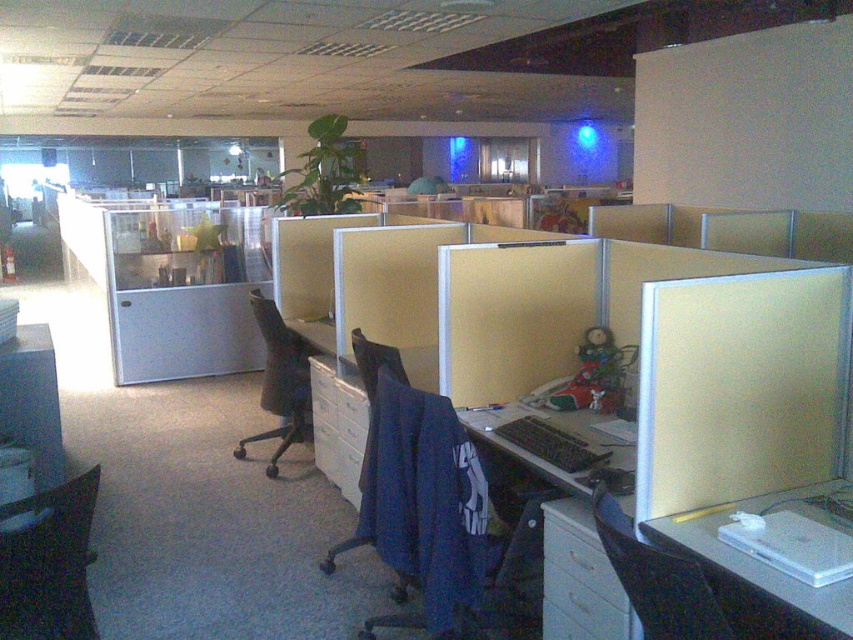
You are an office worker who needs to retrieve a file from the white plastic file cabinet at lower right. You are currently sitting in the black mesh chair at center. Can you reach the file cabinet without moving your chair?

The white plastic file cabinet at lower right is positioned under the black mesh chair at center, meaning it is directly beneath your current seating position. Therefore, you can easily reach down to access the files without needing to move your chair.

You are an office worker who needs to move from your desk to the printer located near the black fabric chair at lower right. Which direction should you move relative to the blue fabric swivel chair at center?

You should move to the right relative to the blue fabric swivel chair at center because the black fabric chair at lower right is positioned to the right of it.